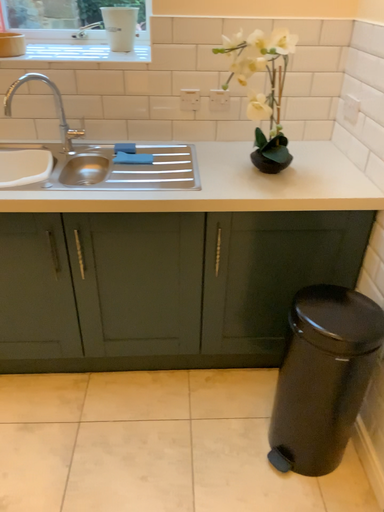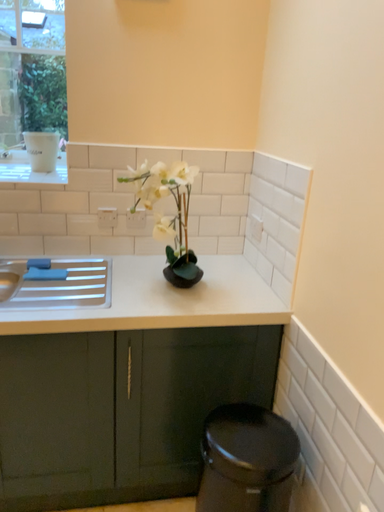
Question: How did the camera likely rotate when shooting the video?

Choices:
 (A) rotated upward
 (B) rotated downward

Answer: (A)